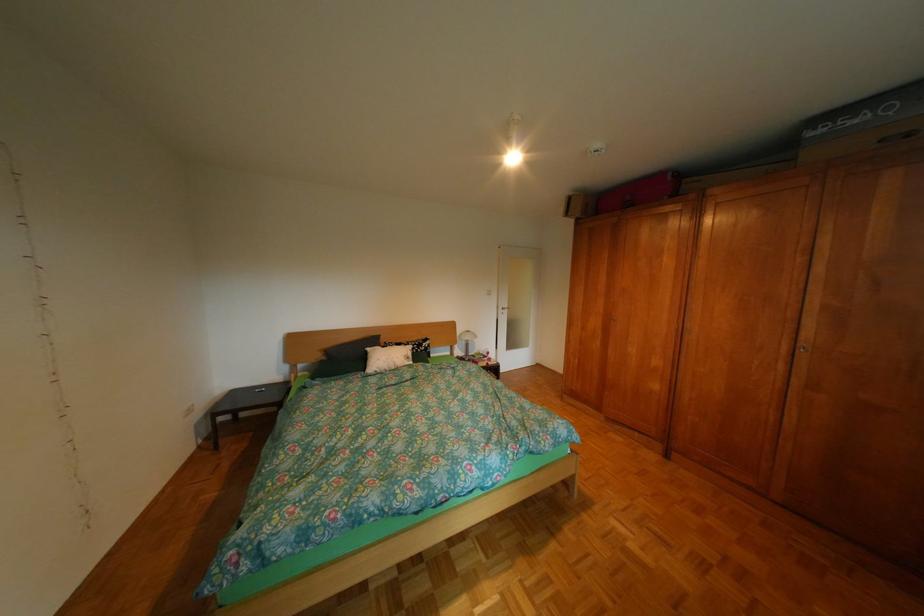
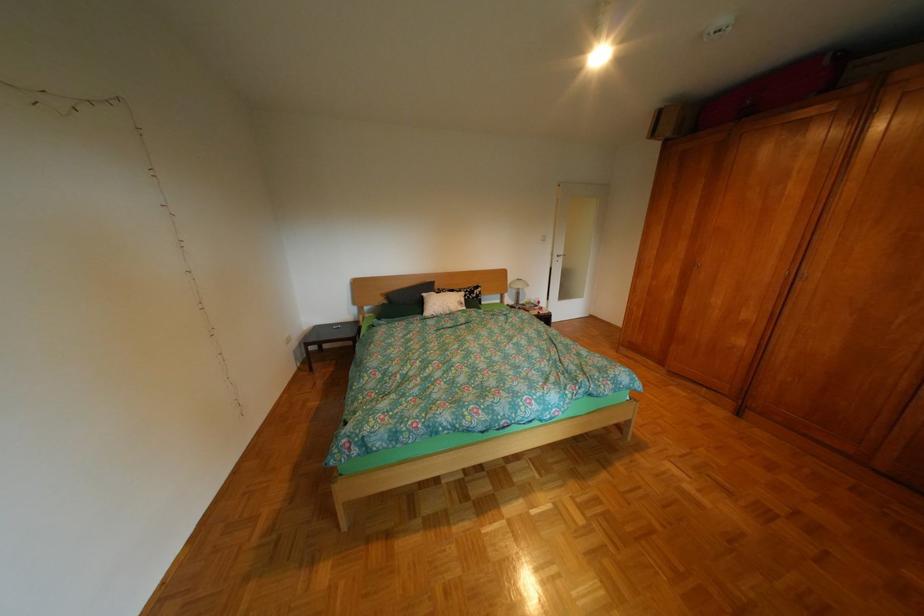
Locate, in the second image, the point that corresponds to pixel 685 179 in the first image.

(842, 63)